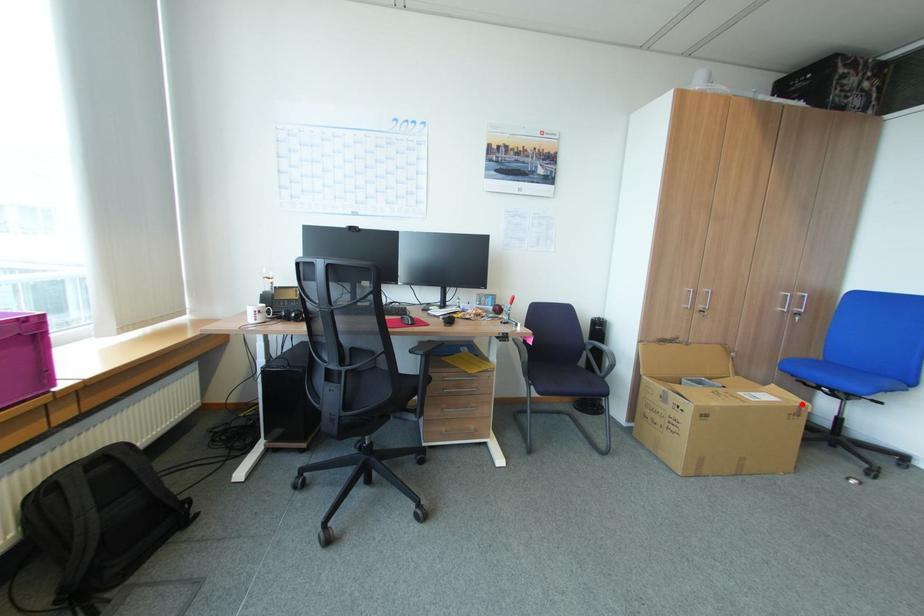
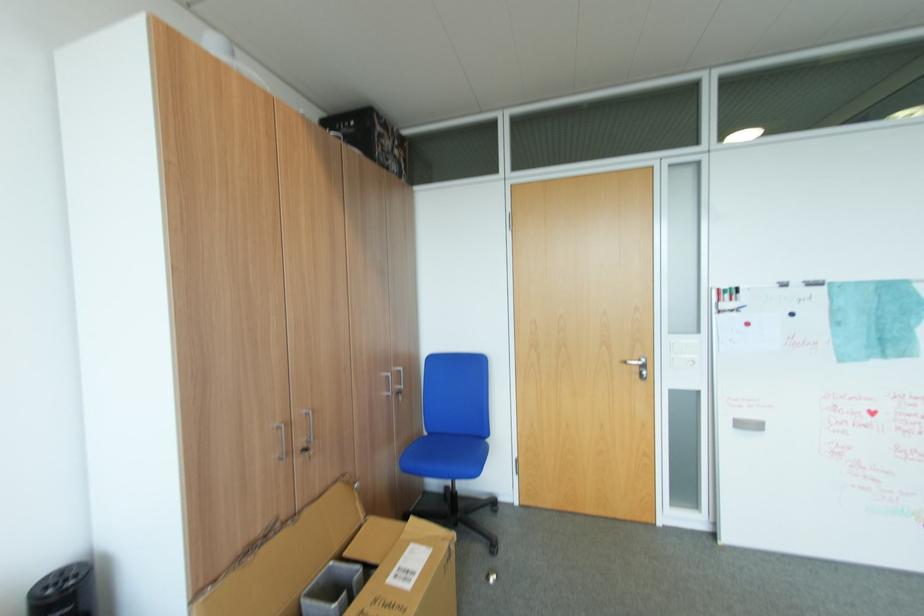
Question: I am providing you with two images of the same scene from different viewpoints. Image1 has a red point marked. In image2, the corresponding 3D location appears at what relative position? Reply with the corresponding letter.

Choices:
 (A) Closer
 (B) Farther

Answer: (A)